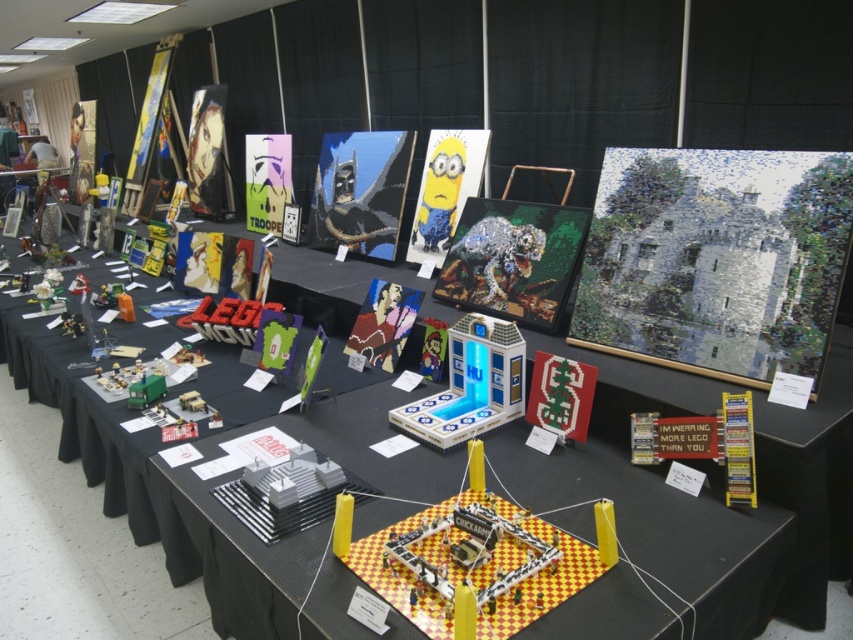
You are an event organizer at the LEGO exhibition. You need to ensure that the white mosaic castle at center and the green plastic toy at center are displayed side by side without overlapping. Given their widths, which one should be placed on the left to accommodate both on the table?

The white mosaic castle at center is wider than the green plastic toy at center. To display them side by side without overlapping, place the white mosaic castle at center on the left so that there is enough space for both.